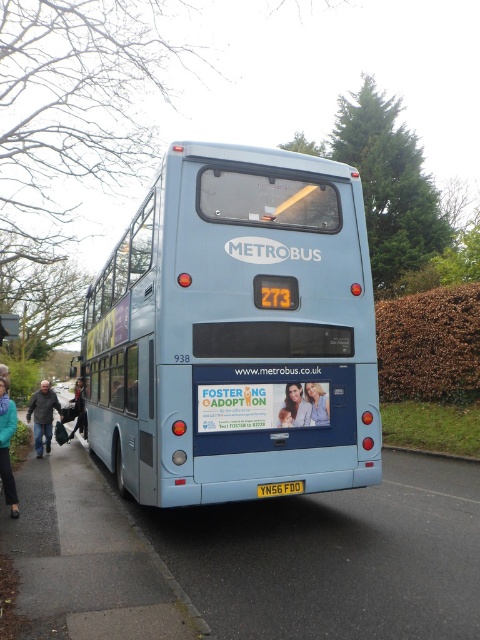
Question: Which object is the farthest from the smooth blue shirt at center?

Choices:
 (A) dark blue jeans at lower left
 (B) dark gray jacket at left
 (C) gray asphalt pavement at lower left

Answer: (A)

Question: Which object is positioned farthest from the dark gray jacket at left?

Choices:
 (A) gray asphalt pavement at lower left
 (B) yellow matte license plate at center
 (C) smooth plastic baby at center

Answer: (A)

Question: Which of these objects is positioned farthest from the gray asphalt pavement at lower left?

Choices:
 (A) light blue matte/deep textured bus at center
 (B) dark gray jacket at left
 (C) smooth blue shirt at center

Answer: (B)

Question: Does light blue matte/deep textured bus at center have a smaller size compared to dark blue jeans at lower left?

Choices:
 (A) yes
 (B) no

Answer: (A)

Question: Observing the image, what is the correct spatial positioning of smooth blue shirt at center in reference to yellow matte license plate at center?

Choices:
 (A) right
 (B) left

Answer: (A)

Question: Is the position of gray asphalt pavement at lower left less distant than that of teal fabric jacket at lower left?

Choices:
 (A) yes
 (B) no

Answer: (A)